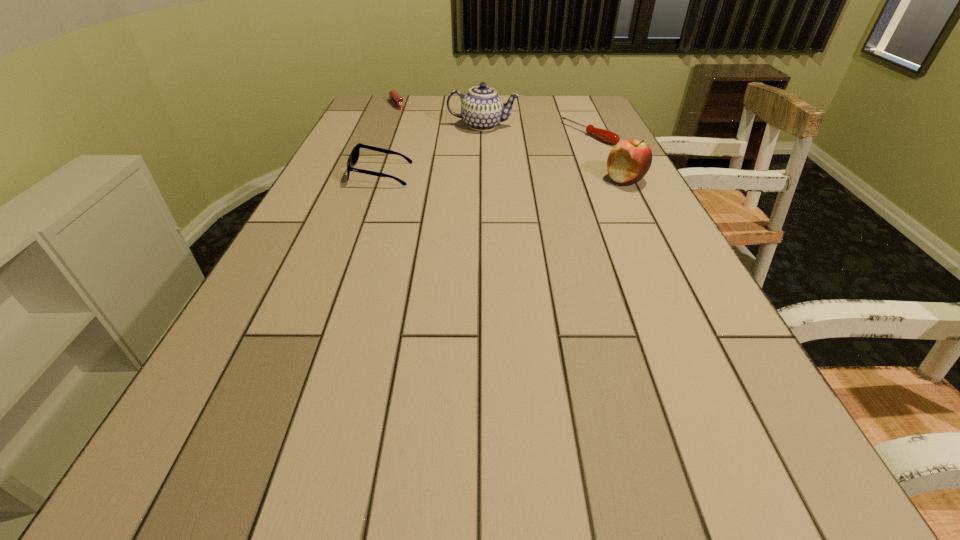
This screenshot has width=960, height=540. Identify the location of vacant space located 0.080m on the bitten side of the apple. (575, 180).

The width and height of the screenshot is (960, 540). Identify the location of vacant space positioned 0.190m at the tip of the shortest object. (529, 159).

Locate an element on the screen. free space located 0.100m at the tip of the shortest object is located at coordinates (551, 151).

Locate an element on the screen. Image resolution: width=960 pixels, height=540 pixels. blank area located 0.360m at the tip of the shortest object is located at coordinates (485, 176).

Where is `vacant space located at the spout of the third object from right to left`? Image resolution: width=960 pixels, height=540 pixels. vacant space located at the spout of the third object from right to left is located at coordinates (473, 148).

The height and width of the screenshot is (540, 960). In order to click on vacant space situated 0.070m at the spout of the third object from right to left in this screenshot , I will do `click(475, 144)`.

The image size is (960, 540). In order to click on free space located 0.230m at the spout of the third object from right to left in this screenshot , I will do `click(467, 167)`.

Identify the location of free region located 0.190m on the front-facing side of the stapler. point(417,129).

Find the location of a particular element. The width and height of the screenshot is (960, 540). vacant space located 0.370m on the front-facing side of the stapler is located at coordinates (437, 150).

This screenshot has height=540, width=960. Find the location of `vacant area located on the front-facing side of the stapler`. vacant area located on the front-facing side of the stapler is located at coordinates (435, 148).